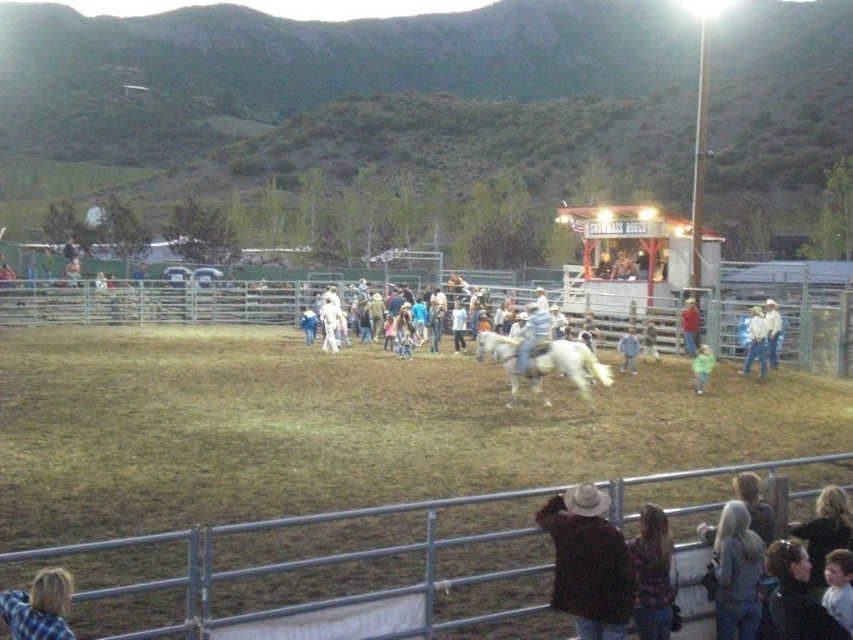
Does metallic silver fence at lower center come behind light brown hair at lower right?

No, it is not.

Locate an element on the screen. The width and height of the screenshot is (853, 640). metallic silver fence at lower center is located at coordinates (270, 564).

Find the location of a particular element. The width and height of the screenshot is (853, 640). metallic silver fence at lower center is located at coordinates point(270,564).

Describe the element at coordinates (544, 362) in the screenshot. I see `white glossy horse at center` at that location.

Who is more distant from viewer, (566,355) or (517,364)?

The point (517,364) is behind.

Locate an element on the screen. Image resolution: width=853 pixels, height=640 pixels. white glossy horse at center is located at coordinates (544, 362).

Based on the photo, how much distance is there between plaid shirt at lower left and green matte shirt at lower center?

16.13 meters

The height and width of the screenshot is (640, 853). What do you see at coordinates (38, 605) in the screenshot? I see `plaid shirt at lower left` at bounding box center [38, 605].

At what (x,y) coordinates should I click in order to perform the action: click on plaid shirt at lower left. Please return your answer as a coordinate pair (x, y). The height and width of the screenshot is (640, 853). Looking at the image, I should click on (38, 605).